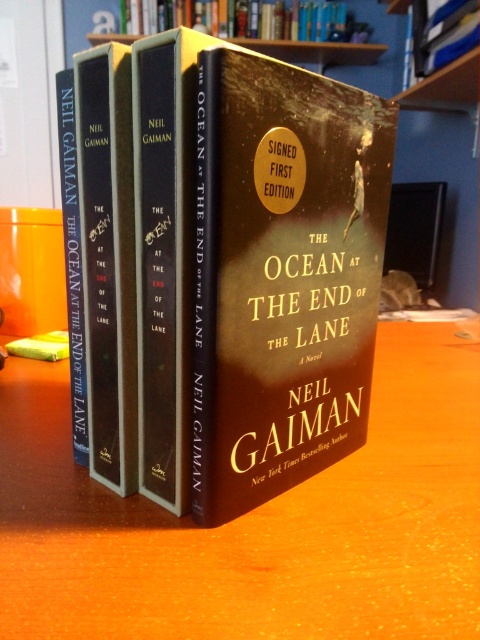
Question: Which object is closer to the camera taking this photo?

Choices:
 (A) brown wooden table at center
 (B) matte hardcover book at center

Answer: (A)

Question: From the image, what is the correct spatial relationship of matte hardcover book at center in relation to hardcover book at upper center?

Choices:
 (A) above
 (B) below

Answer: (B)

Question: Considering the real-world distances, which object is closest to the matte hardcover book at center?

Choices:
 (A) hardcover book at upper center
 (B) brown wooden table at center

Answer: (B)

Question: Which point appears farthest from the camera in this image?

Choices:
 (A) (372, 189)
 (B) (367, 26)

Answer: (B)

Question: Can you confirm if brown wooden table at center is positioned to the left of matte hardcover book at center?

Choices:
 (A) no
 (B) yes

Answer: (B)

Question: Does brown wooden table at center appear on the left side of matte hardcover book at center?

Choices:
 (A) yes
 (B) no

Answer: (A)